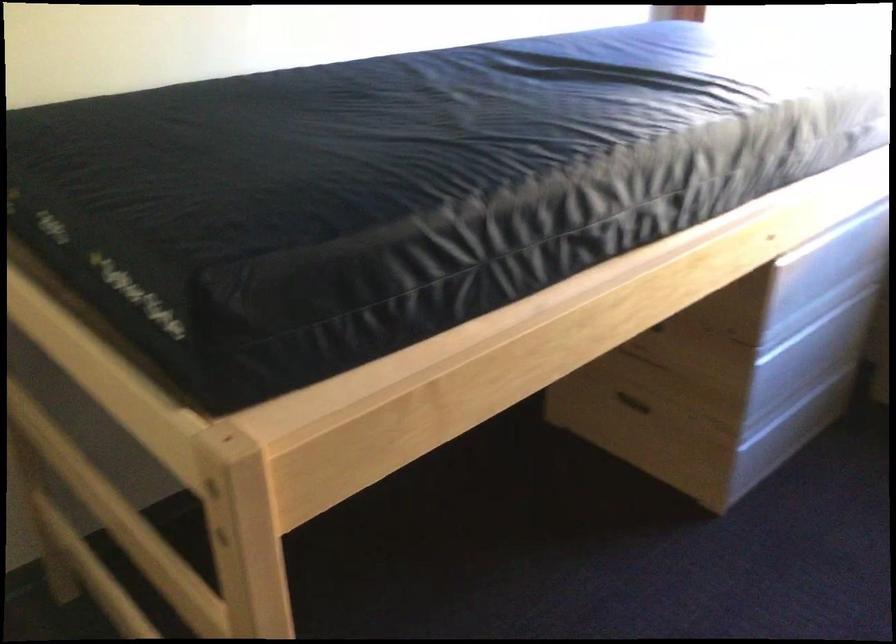
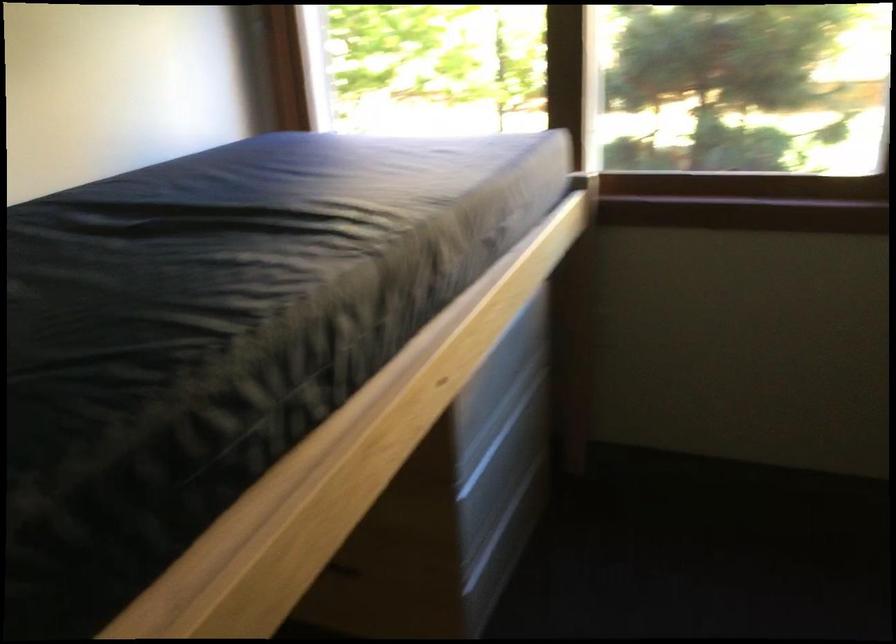
Question: Based on the continuous images, in which direction is the camera rotating? Reply with the corresponding letter.

Choices:
 (A) Left
 (B) Right
 (C) Up
 (D) Down

Answer: (B)